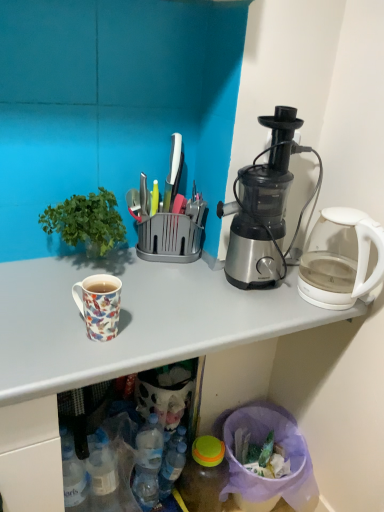
Identify the location of free point to the right of floral ceramic mug at left. coord(168,329).